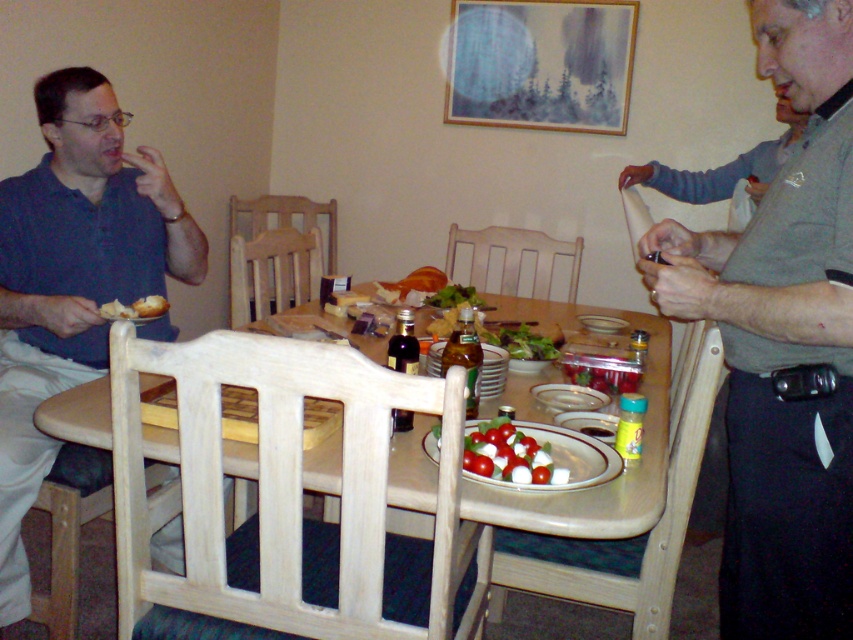
Question: Estimate the real-world distances between objects in this image. Which object is farther from the matte glass platter at center?

Choices:
 (A) wooden table at center
 (B) matte bread at left
 (C) matte blue shirt at left
 (D) white ceramic platter at center

Answer: (C)

Question: Where is gray cotton shirt at right located in relation to wooden table at center in the image?

Choices:
 (A) right
 (B) left

Answer: (A)

Question: Is wooden table at center wider than matte bread at left?

Choices:
 (A) yes
 (B) no

Answer: (A)

Question: Which is farther from the wooden table at center?

Choices:
 (A) matte blue shirt at left
 (B) matte glass platter at center

Answer: (A)

Question: Can you confirm if white ceramic platter at center is smaller than matte bread at left?

Choices:
 (A) no
 (B) yes

Answer: (B)

Question: Among these points, which one is farthest from the camera?

Choices:
 (A) click(585, 461)
 (B) click(38, 413)

Answer: (B)